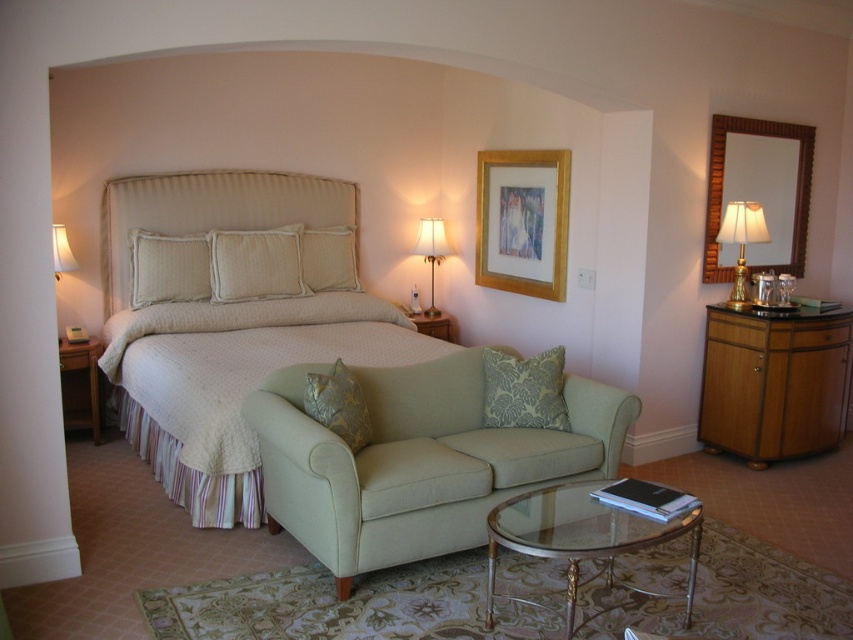
Who is taller, transparent glass coffee table at lower center or textured gold pillow at center?

Standing taller between the two is transparent glass coffee table at lower center.

Who is shorter, transparent glass coffee table at lower center or textured gold pillow at center?

textured gold pillow at center

Describe the element at coordinates (585, 540) in the screenshot. I see `transparent glass coffee table at lower center` at that location.

Find the location of `transparent glass coffee table at lower center`. transparent glass coffee table at lower center is located at coordinates (585, 540).

Is beige quilted bed at center below green damask pillow at center?

Actually, beige quilted bed at center is above green damask pillow at center.

Is point (264, 355) positioned behind point (555, 387)?

Yes, it is behind point (555, 387).

The image size is (853, 640). I want to click on beige quilted bed at center, so click(231, 324).

This screenshot has height=640, width=853. What are the coordinates of `beige quilted bed at center` in the screenshot? It's located at (231, 324).

Who is higher up, beige fabric headboard at center or gold wooden picture frame at upper center?

gold wooden picture frame at upper center

Between beige fabric headboard at center and gold wooden picture frame at upper center, which one has more height?

Standing taller between the two is gold wooden picture frame at upper center.

I want to click on beige fabric headboard at center, so click(212, 211).